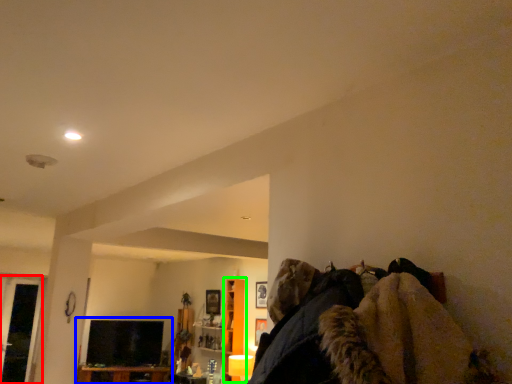
Question: Based on their relative distances, which object is farther from glass door (highlighted by a red box)? Choose from entertainment center (highlighted by a blue box) and cabinet (highlighted by a green box).

Choices:
 (A) entertainment center
 (B) cabinet

Answer: (B)